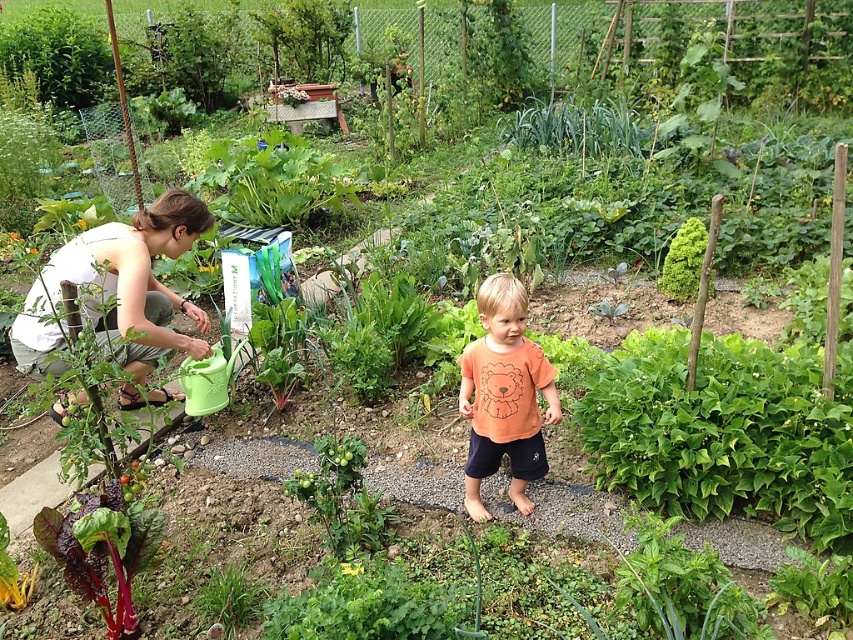
In the scene shown: You are a photographer trying to capture a group photo of the white cotton shirt at left and orange cotton shirt at center in the garden. If you want to ensure both shirts are fully visible in the frame without cropping any part of them, which shirt should you position closer to the camera to avoid overlapping?

The white cotton shirt at left is wider than the orange cotton shirt at center, so positioning the white cotton shirt at left closer to the camera will help ensure it fits within the frame without overlapping the orange cotton shirt at center.

You are the child in the garden. You want to hand a toy to the white cotton shirt at left without stepping on the deep red leafy vegetable at lower left. Can you do this while staying on the gravel path?

The white cotton shirt at left is closer to you than the deep red leafy vegetable at lower left, so yes, you can hand the toy to the white cotton shirt at left while staying on the gravel path without stepping on the deep red leafy vegetable at lower left.